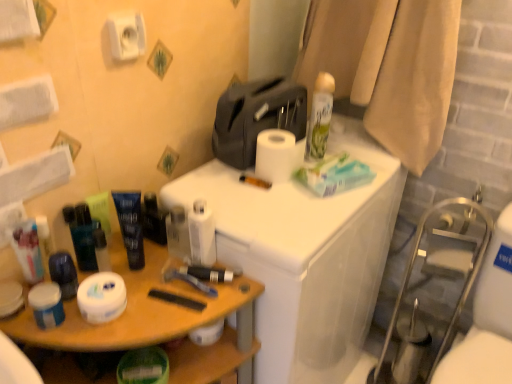
Identify the location of vacant space in front of white matte toilet paper at upper center, which ranks as the 2th toilet paper in top-to-bottom order. The height and width of the screenshot is (384, 512). (279, 216).